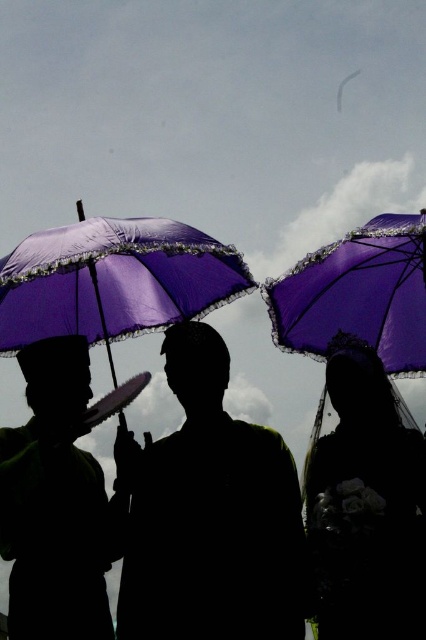
Question: In this image, where is matte purple umbrella at right located relative to purple lace umbrella at upper right?

Choices:
 (A) right
 (B) left

Answer: (B)

Question: Can you confirm if silhouette umbrella at center is positioned below matte purple umbrella at right?

Choices:
 (A) yes
 (B) no

Answer: (B)

Question: Does silhouette umbrella at center appear on the left side of matte purple umbrella at left?

Choices:
 (A) yes
 (B) no

Answer: (B)

Question: Which of the following is the farthest from the observer?

Choices:
 (A) matte purple umbrella at right
 (B) silhouette umbrella at center
 (C) matte purple umbrella at left

Answer: (C)

Question: Which point is closer to the camera?

Choices:
 (A) (419, 474)
 (B) (419, 369)

Answer: (A)

Question: Among these points, which one is nearest to the camera?

Choices:
 (A) (176, 280)
 (B) (37, 611)
 (C) (376, 561)
 (D) (382, 326)

Answer: (C)